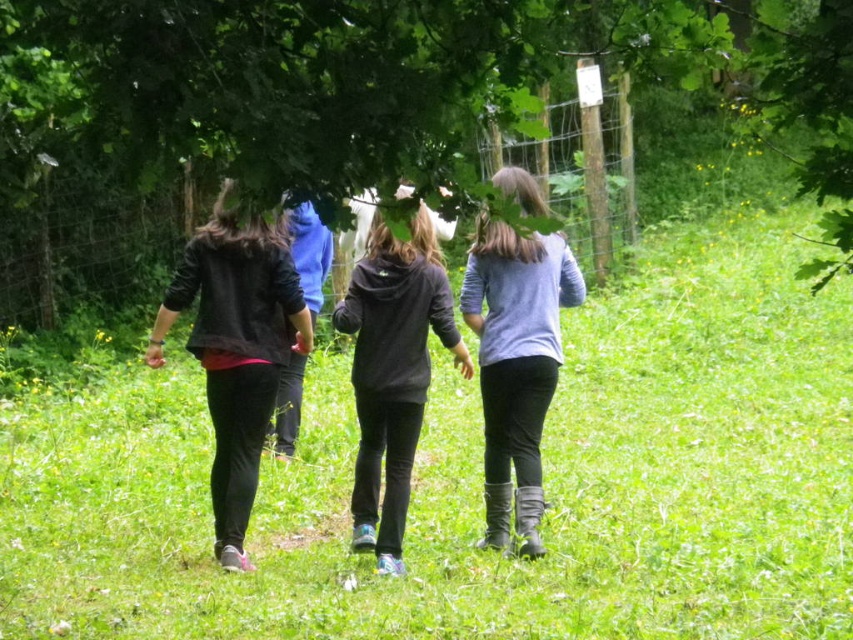
Between green grassy at center and dark gray hoodie at center, which one appears on the left side from the viewer's perspective?

dark gray hoodie at center is more to the left.

Which is behind, point (816, 445) or point (373, 513)?

The point (816, 445) is behind.

Is point (659, 577) positioned in front of point (363, 516)?

Yes, point (659, 577) is in front of point (363, 516).

You are a GUI agent. You are given a task and a screenshot of the screen. Output one action in this format:
    pyautogui.click(x=<x>, y=<y>)
    Task: Click on the green grassy at center
    This screenshot has height=640, width=853.
    Given the screenshot: What is the action you would take?
    pyautogui.click(x=480, y=481)

Does green grassy at center come behind light blue fabric jacket at center?

No.

Describe the element at coordinates (480, 481) in the screenshot. The height and width of the screenshot is (640, 853). I see `green grassy at center` at that location.

Is point (747, 291) positioned in front of point (503, 484)?

No, it is behind (503, 484).

The image size is (853, 640). Identify the location of green grassy at center. (480, 481).

From the picture: Is green leafy tree at upper center closer to camera compared to dark gray hoodie at center?

Yes, green leafy tree at upper center is in front of dark gray hoodie at center.

Locate an element on the screen. The image size is (853, 640). green leafy tree at upper center is located at coordinates (381, 83).

Image resolution: width=853 pixels, height=640 pixels. I want to click on green leafy tree at upper center, so click(381, 83).